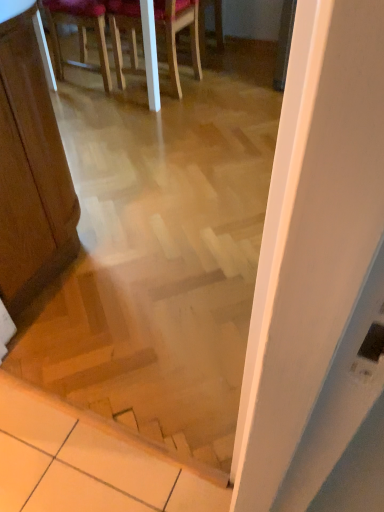
I want to click on vacant area that is in front of wooden chair at upper center, which is the 1th chair in left-to-right order, so click(91, 102).